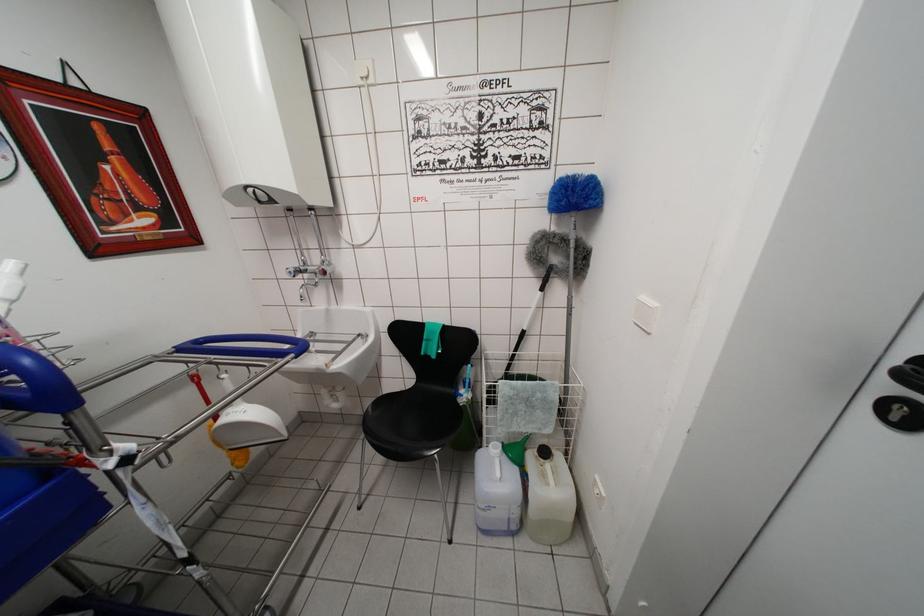
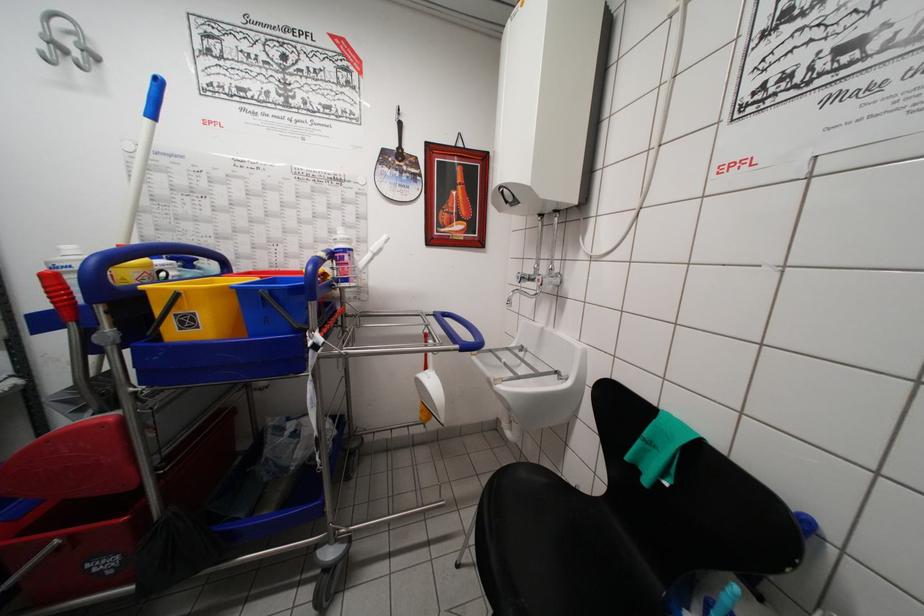
In the second image, find the point that corresponds to (262,206) in the first image.

(511, 207)